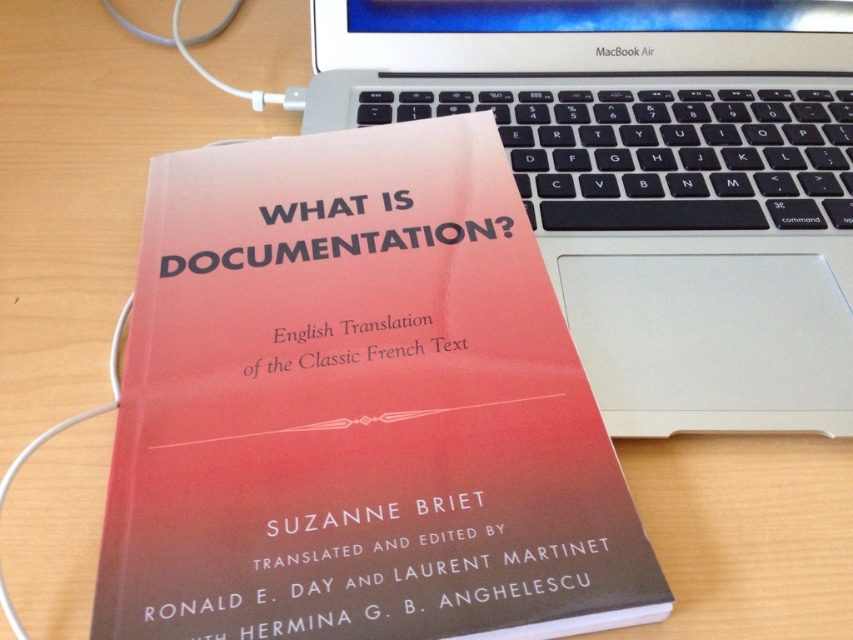
You are organizing a desk space and want to place the matte paper book at center and the sleek silver laptop at upper center side by side. Given their widths, which item should be placed first to ensure they fit properly?

The matte paper book at center has a lesser width compared to the sleek silver laptop at upper center, so you should place the sleek silver laptop at upper center first to accommodate its larger width before placing the matte paper book at center.

You are organizing a study space and want to ensure that the matte paper book at center and the sleek silver laptop at upper center are arranged so that the book is not obstructed by the laptop. Based on their current positions, is the book currently visible without being blocked by the laptop?

The matte paper book at center is located below the sleek silver laptop at upper center, so it is not obstructed and remains visible.